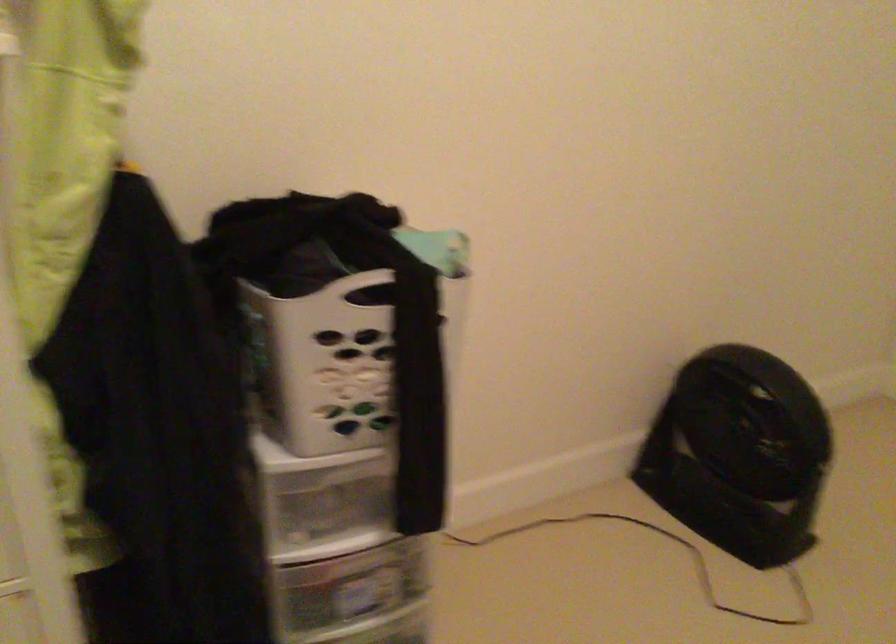
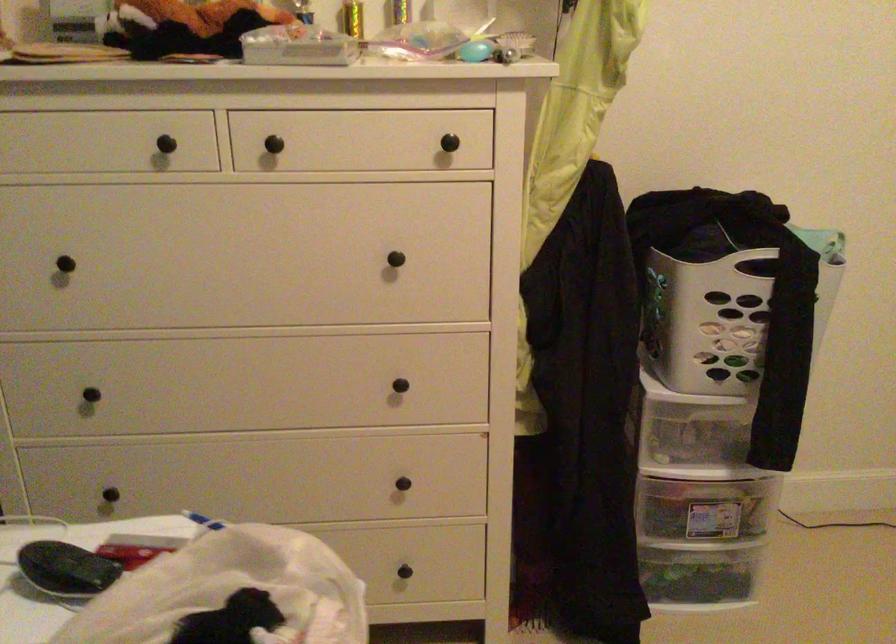
Find the pixel in the second image that matches pixel 449 298 in the first image.

(829, 277)